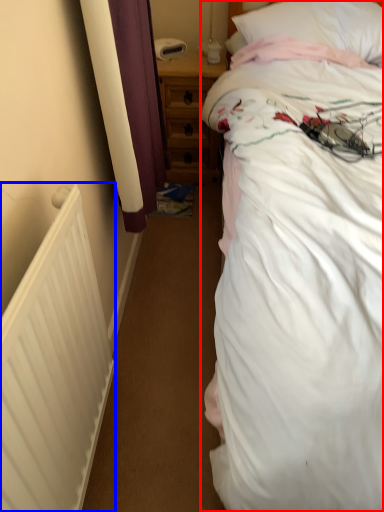
Question: Which object appears farthest to the camera in this image, bed (highlighted by a red box) or radiator (highlighted by a blue box)?

Choices:
 (A) bed
 (B) radiator

Answer: (B)